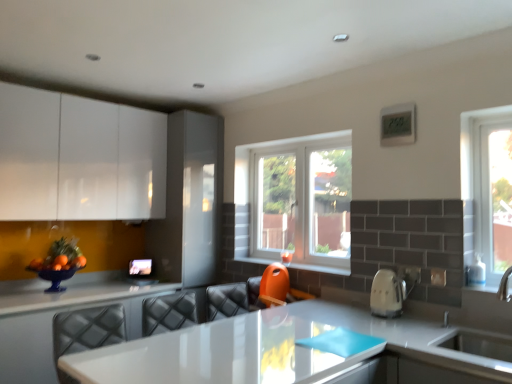
At what (x,y) coordinates should I click in order to perform the action: click on free location above white glossy table at center (from a real-world perspective). Please return your answer as a coordinate pair (x, y). The height and width of the screenshot is (384, 512). Looking at the image, I should click on (264, 330).